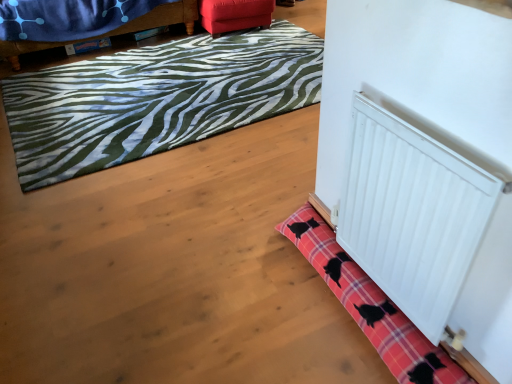
Question: Considering the relative sizes of velvet red ottoman at upper center, the second furniture viewed from the left, and green zebra-patterned rug at upper left, the 1th bath mat in the back-to-front sequence, in the image provided, is velvet red ottoman at upper center, the second furniture viewed from the left, thinner than green zebra-patterned rug at upper left, the 1th bath mat in the back-to-front sequence,?

Choices:
 (A) no
 (B) yes

Answer: (B)

Question: Is the position of velvet red ottoman at upper center, the first furniture from the right, more distant than that of green zebra-patterned rug at upper left, acting as the 2th bath mat starting from the front?

Choices:
 (A) yes
 (B) no

Answer: (A)

Question: Can you confirm if velvet red ottoman at upper center, the second furniture viewed from the left, is wider than green zebra-patterned rug at upper left, the 2th bath mat in the bottom-to-top sequence?

Choices:
 (A) yes
 (B) no

Answer: (B)

Question: From the image's perspective, does velvet red ottoman at upper center, the second furniture viewed from the left, appear lower than green zebra-patterned rug at upper left, the 1th bath mat in the back-to-front sequence?

Choices:
 (A) yes
 (B) no

Answer: (B)

Question: From the image's perspective, is velvet red ottoman at upper center, the first furniture from the right, over green zebra-patterned rug at upper left, the 1th bath mat in the back-to-front sequence?

Choices:
 (A) yes
 (B) no

Answer: (A)

Question: Considering their positions, is pink plaid bath mat at lower right, marked as the 2th bath mat in a top-to-bottom arrangement, located in front of or behind velvet blue blanket at upper left, which is the 2th furniture in right-to-left order?

Choices:
 (A) behind
 (B) front

Answer: (B)

Question: Would you say pink plaid bath mat at lower right, marked as the 2th bath mat in a top-to-bottom arrangement, is to the left or to the right of velvet blue blanket at upper left, which is the 2th furniture in right-to-left order, in the picture?

Choices:
 (A) left
 (B) right

Answer: (B)

Question: From a real-world perspective, is pink plaid bath mat at lower right, placed as the 1th bath mat when sorted from front to back, above or below velvet blue blanket at upper left, which is the 2th furniture in right-to-left order?

Choices:
 (A) below
 (B) above

Answer: (A)

Question: Is pink plaid bath mat at lower right, marked as the 2th bath mat in a top-to-bottom arrangement, wider or thinner than velvet blue blanket at upper left, positioned as the 1th furniture in left-to-right order?

Choices:
 (A) thin
 (B) wide

Answer: (A)

Question: In the image, is velvet red ottoman at upper center, the first furniture from the right, on the left side or the right side of velvet blue blanket at upper left, which is the 2th furniture in right-to-left order?

Choices:
 (A) left
 (B) right

Answer: (B)

Question: From a real-world perspective, relative to velvet blue blanket at upper left, which is the 2th furniture in right-to-left order, is velvet red ottoman at upper center, the second furniture viewed from the left, vertically above or below?

Choices:
 (A) below
 (B) above

Answer: (A)

Question: Does point (205, 29) appear closer or farther from the camera than point (177, 18)?

Choices:
 (A) farther
 (B) closer

Answer: (A)

Question: Considering the positions of velvet red ottoman at upper center, the first furniture from the right, and velvet blue blanket at upper left, which is the 2th furniture in right-to-left order, in the image, is velvet red ottoman at upper center, the first furniture from the right, wider or thinner than velvet blue blanket at upper left, which is the 2th furniture in right-to-left order,?

Choices:
 (A) wide
 (B) thin

Answer: (B)

Question: Looking at the image, does white smooth radiator at lower right seem bigger or smaller compared to green zebra-patterned rug at upper left, the 1th bath mat from the top?

Choices:
 (A) big
 (B) small

Answer: (B)

Question: Considering the positions of point (437, 170) and point (208, 84), is point (437, 170) closer or farther from the camera than point (208, 84)?

Choices:
 (A) farther
 (B) closer

Answer: (B)